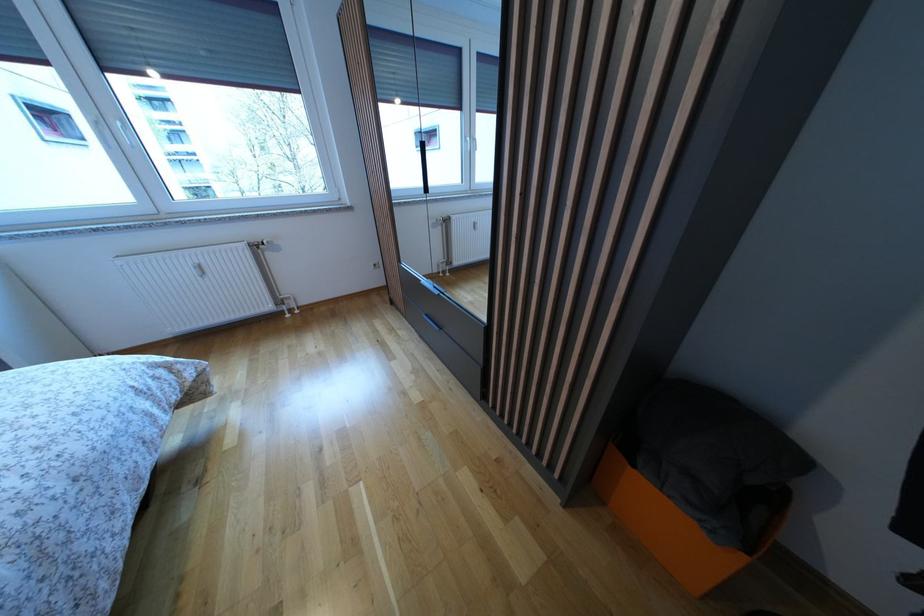
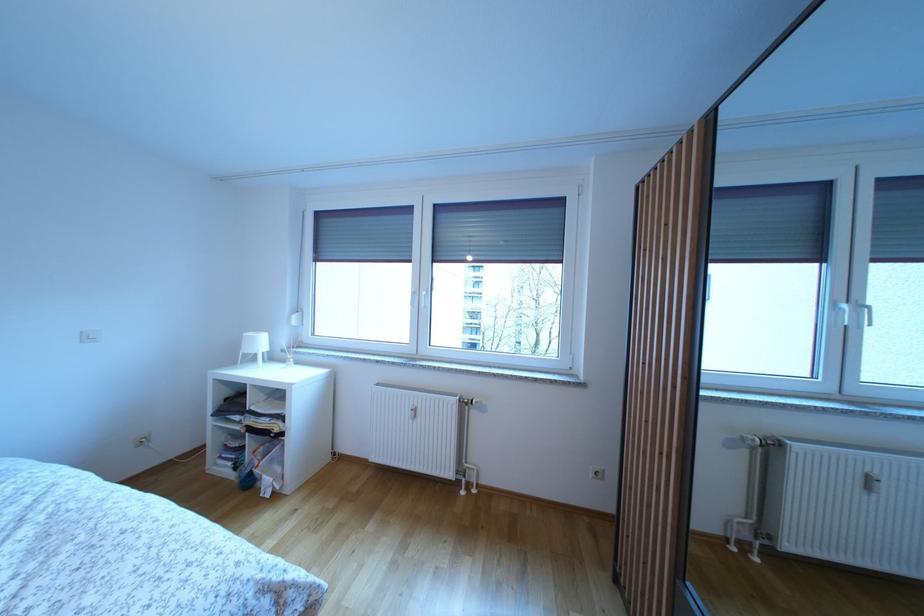
Based on the continuous images, in which direction is the camera rotating?

The rotation direction of the camera is left-up.